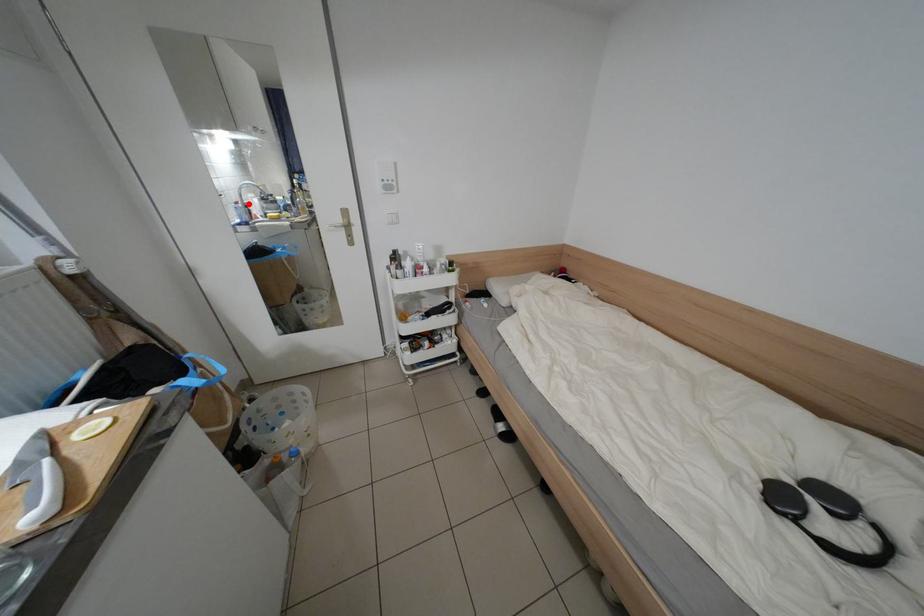
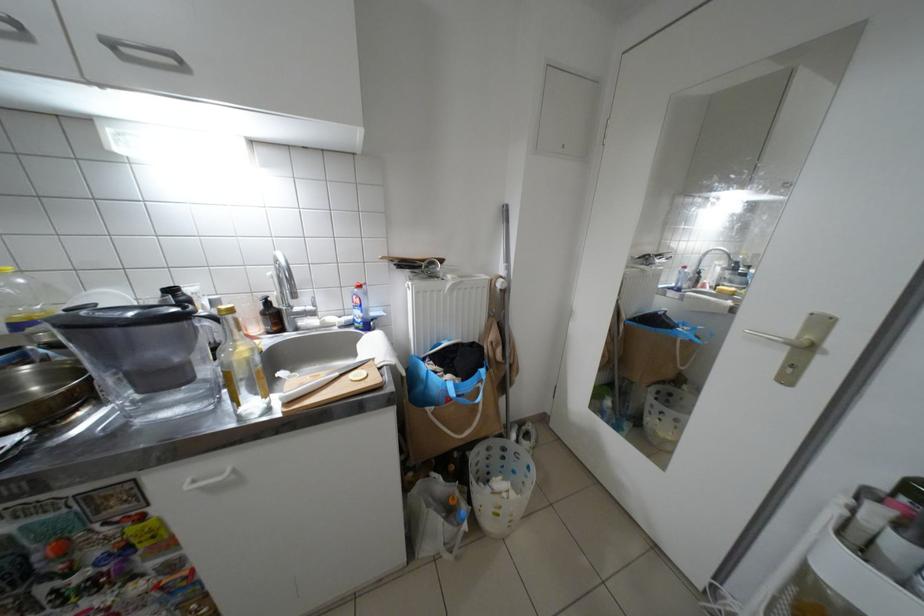
Find the pixel in the second image that matches the highlighted location in the first image.

(697, 269)